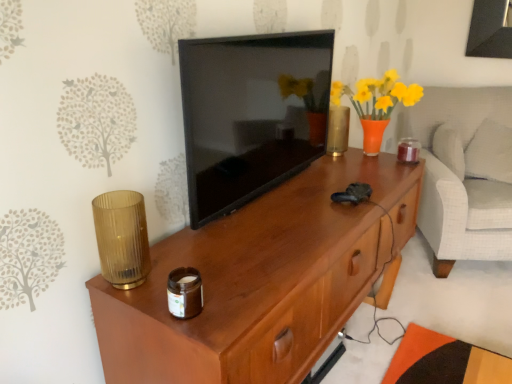
Where is `vacant point to the left of translucent amber glass candle at right, the 3th candle holder viewed from the left`? The width and height of the screenshot is (512, 384). vacant point to the left of translucent amber glass candle at right, the 3th candle holder viewed from the left is located at coordinates (371, 160).